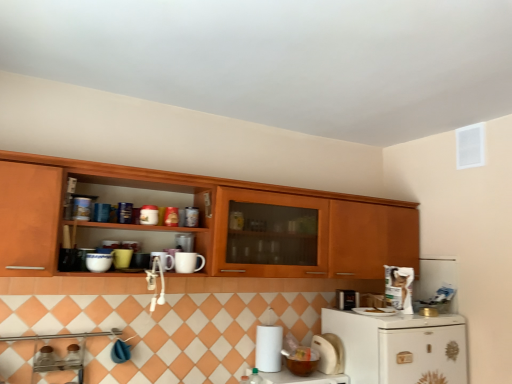
The image size is (512, 384). I want to click on matte brown bowl at lower center, which appears as the 7th appliance when viewed from the left, so click(302, 361).

The width and height of the screenshot is (512, 384). Describe the element at coordinates (185, 242) in the screenshot. I see `white glossy mug at upper center, the sixth appliance from the right` at that location.

Locate an element on the screen. Image resolution: width=512 pixels, height=384 pixels. matte brown bowl at lower center, which appears as the 7th appliance when viewed from the left is located at coordinates (302, 361).

Could you tell me if white glossy mug at upper center, the 4th appliance in the left-to-right sequence, is turned towards matte ceramic bowl at upper center, the 1th appliance viewed from the left?

No, white glossy mug at upper center, the 4th appliance in the left-to-right sequence, is not turned towards matte ceramic bowl at upper center, the 1th appliance viewed from the left.

Which object is positioned more to the right, white glossy mug at upper center, the 4th appliance in the left-to-right sequence, or matte ceramic bowl at upper center, the 1th appliance viewed from the left?

From the viewer's perspective, white glossy mug at upper center, the 4th appliance in the left-to-right sequence, appears more on the right side.

Which is correct: white glossy mug at upper center, the 4th appliance in the left-to-right sequence, is inside matte ceramic bowl at upper center, the 1th appliance viewed from the left, or outside of it?

The correct answer is: outside.

Does point (153, 255) lie behind point (87, 262)?

Yes.

Is matte ceramic bowl at upper center, the 10th appliance viewed from the right, facing away from matte brown bowl at lower center, placed as the 4th appliance when sorted from right to left?

No, matte ceramic bowl at upper center, the 10th appliance viewed from the right, is not facing the opposite direction of matte brown bowl at lower center, placed as the 4th appliance when sorted from right to left.

From the picture: Does matte ceramic bowl at upper center, the 1th appliance viewed from the left, have a lesser height compared to matte brown bowl at lower center, which appears as the 7th appliance when viewed from the left?

Yes, matte ceramic bowl at upper center, the 1th appliance viewed from the left, is shorter than matte brown bowl at lower center, which appears as the 7th appliance when viewed from the left.

Is matte ceramic bowl at upper center, the 1th appliance viewed from the left, positioned in front of matte brown bowl at lower center, placed as the 4th appliance when sorted from right to left?

Yes, the depth of matte ceramic bowl at upper center, the 1th appliance viewed from the left, is less than that of matte brown bowl at lower center, placed as the 4th appliance when sorted from right to left.

Which object is thinner, matte ceramic bowl at upper center, the 10th appliance viewed from the right, or matte brown bowl at lower center, placed as the 4th appliance when sorted from right to left?

matte ceramic bowl at upper center, the 10th appliance viewed from the right, is thinner.

Can you tell me how much satin silver toaster at lower right, which is counted as the 9th appliance, starting from the left, and white matte paper towel holder at lower right, placed as the 8th appliance when sorted from left to right, differ in facing direction?

The angular difference between satin silver toaster at lower right, which is counted as the 9th appliance, starting from the left, and white matte paper towel holder at lower right, placed as the 8th appliance when sorted from left to right, is 9.6 degrees.

Can you see satin silver toaster at lower right, which is counted as the 9th appliance, starting from the left, touching white matte paper towel holder at lower right, acting as the 3th appliance starting from the right?

There is a gap between satin silver toaster at lower right, which is counted as the 9th appliance, starting from the left, and white matte paper towel holder at lower right, acting as the 3th appliance starting from the right.

From the image's perspective, is satin silver toaster at lower right, which is counted as the 9th appliance, starting from the left, above white matte paper towel holder at lower right, acting as the 3th appliance starting from the right?

Yes, from the image's perspective, satin silver toaster at lower right, which is counted as the 9th appliance, starting from the left, is above white matte paper towel holder at lower right, acting as the 3th appliance starting from the right.

Can you tell me how much matte ceramic bowl at upper center, the 1th appliance viewed from the left, and satin silver toaster at lower right, the second appliance in the right-to-left sequence, differ in facing direction?

matte ceramic bowl at upper center, the 1th appliance viewed from the left, and satin silver toaster at lower right, the second appliance in the right-to-left sequence, are facing 10.8 degrees away from each other.

From the picture: Is matte ceramic bowl at upper center, the 1th appliance viewed from the left, oriented away from satin silver toaster at lower right, the second appliance in the right-to-left sequence?

No, satin silver toaster at lower right, the second appliance in the right-to-left sequence, is not at the back of matte ceramic bowl at upper center, the 1th appliance viewed from the left.

Considering the points (90, 266) and (339, 301), which point is behind, point (90, 266) or point (339, 301)?

The point (339, 301) is farther.

Is matte ceramic bowl at upper center, the 1th appliance viewed from the left, to the right of satin silver toaster at lower right, the second appliance in the right-to-left sequence, from the viewer's perspective?

Incorrect, matte ceramic bowl at upper center, the 1th appliance viewed from the left, is not on the right side of satin silver toaster at lower right, the second appliance in the right-to-left sequence.

In the scene shown: Is satin silver toaster at lower right, the second appliance in the right-to-left sequence, bigger than matte ceramic mug at upper center, positioned as the ninth appliance in right-to-left order?

Correct, satin silver toaster at lower right, the second appliance in the right-to-left sequence, is larger in size than matte ceramic mug at upper center, positioned as the ninth appliance in right-to-left order.

From the image's perspective, would you say satin silver toaster at lower right, the second appliance in the right-to-left sequence, is shown under matte ceramic mug at upper center, positioned as the ninth appliance in right-to-left order?

Yes, from the image's perspective, satin silver toaster at lower right, the second appliance in the right-to-left sequence, is beneath matte ceramic mug at upper center, positioned as the ninth appliance in right-to-left order.

Is matte ceramic mug at upper center, acting as the 2th appliance starting from the left, inside satin silver toaster at lower right, the second appliance in the right-to-left sequence?

No, matte ceramic mug at upper center, acting as the 2th appliance starting from the left, is not a part of satin silver toaster at lower right, the second appliance in the right-to-left sequence.

Which object is thinner, white glossy mug at upper center, which is counted as the 7th appliance, starting from the right, or white glossy canister at upper center, which ranks as the 8th appliance in right-to-left order?

With smaller width is white glossy canister at upper center, which ranks as the 8th appliance in right-to-left order.

Who is more distant, white glossy mug at upper center, which is counted as the 7th appliance, starting from the right, or white glossy canister at upper center, which ranks as the 8th appliance in right-to-left order?

white glossy mug at upper center, which is counted as the 7th appliance, starting from the right, is behind.

Looking at this image, based on their sizes in the image, would you say white glossy mug at upper center, the 4th appliance in the left-to-right sequence, is bigger or smaller than white glossy canister at upper center, which is the 3th appliance from left to right?

Considering their sizes, white glossy mug at upper center, the 4th appliance in the left-to-right sequence, takes up more space than white glossy canister at upper center, which is the 3th appliance from left to right.

Are white glossy mug at upper center, the 4th appliance in the left-to-right sequence, and white glossy canister at upper center, which ranks as the 8th appliance in right-to-left order, far apart?

white glossy mug at upper center, the 4th appliance in the left-to-right sequence, is near white glossy canister at upper center, which ranks as the 8th appliance in right-to-left order, not far away.

From the image's perspective, relative to white glossy mug at upper center, the 5th appliance from the left, is white glossy mug at upper center, the 4th appliance in the left-to-right sequence, above or below?

From the image's perspective, white glossy mug at upper center, the 4th appliance in the left-to-right sequence, appears below white glossy mug at upper center, the 5th appliance from the left.

Which of these two, white glossy mug at upper center, which is counted as the 7th appliance, starting from the right, or white glossy mug at upper center, the 5th appliance from the left, is smaller?

With smaller size is white glossy mug at upper center, the 5th appliance from the left.

What's the angular difference between white glossy mug at upper center, the 4th appliance in the left-to-right sequence, and white glossy mug at upper center, the sixth appliance from the right,'s facing directions?

0.00169 degrees separate the facing orientations of white glossy mug at upper center, the 4th appliance in the left-to-right sequence, and white glossy mug at upper center, the sixth appliance from the right.

From a real-world perspective, who is located lower, white glossy mug at upper center, which is counted as the 7th appliance, starting from the right, or white glossy mug at upper center, the 5th appliance from the left?

white glossy mug at upper center, which is counted as the 7th appliance, starting from the right, from a real-world perspective.

This screenshot has height=384, width=512. Find the location of `the 2nd appliance above when counting from the white glossy mug at upper center, which is counted as the 7th appliance, starting from the right (from the image's perspective)`. the 2nd appliance above when counting from the white glossy mug at upper center, which is counted as the 7th appliance, starting from the right (from the image's perspective) is located at coordinates (98, 262).

You are a GUI agent. You are given a task and a screenshot of the screen. Output one action in this format:
    pyautogui.click(x=<x>, y=<y>)
    Task: Click on the 6th appliance to the left of the matte brown bowl at lower center, which appears as the 7th appliance when viewed from the left, starting your count from the anchor
    Image resolution: width=512 pixels, height=384 pixels.
    Given the screenshot: What is the action you would take?
    pyautogui.click(x=98, y=262)

Considering their positions, is white glossy mug at upper center, which is counted as the 7th appliance, starting from the right, positioned closer to white glossy mug at upper center, the 5th appliance from the left, than matte brown bowl at lower center, which appears as the 7th appliance when viewed from the left?

white glossy mug at upper center, which is counted as the 7th appliance, starting from the right, is closer to white glossy mug at upper center, the 5th appliance from the left.

Which object lies further to the anchor point white matte paper towel at lower center, wooden cabinet at upper center or white glossy mug at upper center, which is counted as the 7th appliance, starting from the right?

Answer: white glossy mug at upper center, which is counted as the 7th appliance, starting from the right, is further to white matte paper towel at lower center.

Looking at the image, which one is located closer to satin silver toaster at lower right, which is counted as the 9th appliance, starting from the left, white matte paper towel holder at lower right, acting as the 3th appliance starting from the right, or white glossy refrigerator at lower right?

white matte paper towel holder at lower right, acting as the 3th appliance starting from the right, is positioned closer to the anchor satin silver toaster at lower right, which is counted as the 9th appliance, starting from the left.

Estimate the real-world distances between objects in this image. Which object is closer to white glossy bowl at lower center, white plastic plate at lower right, placed as the tenth appliance when sorted from left to right, or satin silver toaster at lower right, the second appliance in the right-to-left sequence?

The object closer to white glossy bowl at lower center is white plastic plate at lower right, placed as the tenth appliance when sorted from left to right.

Based on their spatial positions, is white glossy mug at upper center, the 5th appliance from the left, or wooden cabinet at upper center closer to white glossy refrigerator at lower right?

wooden cabinet at upper center.

From the image, which object appears to be farther from matte brown bowl at lower center, placed as the 4th appliance when sorted from right to left, satin silver toaster at lower right, which is counted as the 9th appliance, starting from the left, or white glossy mug at upper center, which is counted as the 7th appliance, starting from the right?

white glossy mug at upper center, which is counted as the 7th appliance, starting from the right, is positioned further to the anchor matte brown bowl at lower center, placed as the 4th appliance when sorted from right to left.

In the scene shown: When comparing their distances from white glossy refrigerator at lower right, does matte ceramic mug at upper center, acting as the 2th appliance starting from the left, or white glossy mug at upper center, the 4th appliance in the left-to-right sequence, seem closer?

The object closer to white glossy refrigerator at lower right is white glossy mug at upper center, the 4th appliance in the left-to-right sequence.

From the image, which object appears to be nearer to matte brown bowl at lower center, placed as the 4th appliance when sorted from right to left, white matte paper towel at lower center or white glossy bowl at lower center?

The object closer to matte brown bowl at lower center, placed as the 4th appliance when sorted from right to left, is white glossy bowl at lower center.

This screenshot has height=384, width=512. In order to click on counter top between matte ceramic bowl at upper center, the 10th appliance viewed from the right, and white matte paper towel holder at lower right, acting as the 3th appliance starting from the right in this screenshot , I will do `click(303, 378)`.

You are a GUI agent. You are given a task and a screenshot of the screen. Output one action in this format:
    pyautogui.click(x=<x>, y=<y>)
    Task: Click on the counter top between white glossy mug at upper center, the 4th appliance in the left-to-right sequence, and white glossy refrigerator at lower right, in the horizontal direction
    The image size is (512, 384).
    Given the screenshot: What is the action you would take?
    pyautogui.click(x=303, y=378)

The image size is (512, 384). In order to click on paper towel situated between white glossy canister at upper center, which is the 3th appliance from left to right, and white matte paper towel holder at lower right, acting as the 3th appliance starting from the right, from left to right in this screenshot , I will do `click(268, 348)`.

Image resolution: width=512 pixels, height=384 pixels. Identify the location of paper towel between matte ceramic bowl at upper center, the 10th appliance viewed from the right, and white matte paper towel holder at lower right, acting as the 3th appliance starting from the right, in the horizontal direction. (268, 348).